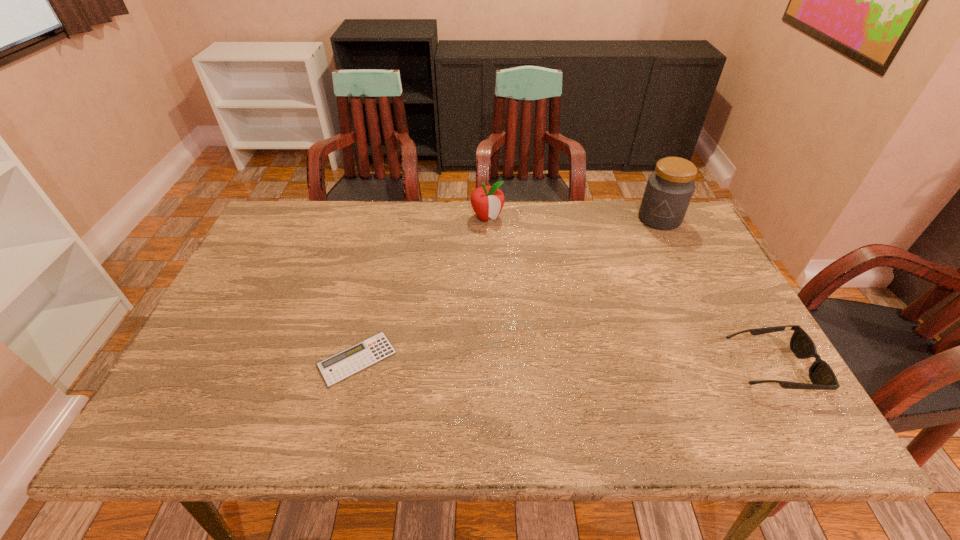
Where is `vacant space on the desktop that is between the leftmost object and the sunglasses and is positioned on the side where a bite is taken out of the second tallest object`? The height and width of the screenshot is (540, 960). vacant space on the desktop that is between the leftmost object and the sunglasses and is positioned on the side where a bite is taken out of the second tallest object is located at coordinates (577, 363).

The image size is (960, 540). In order to click on vacant space on the desktop that is between the leftmost object and the third tallest object and is positioned on the surface of the tallest object near the warning symbol in this screenshot , I will do [591, 363].